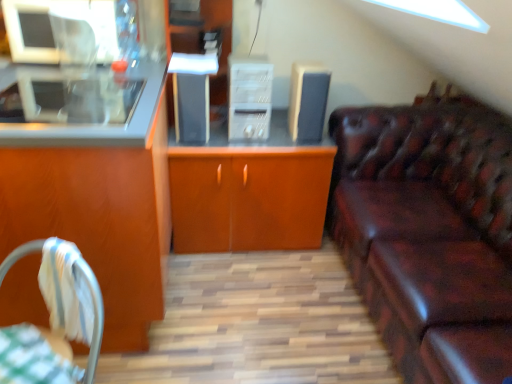
Question: Is satin black speaker at center, which appears as the second appliance when viewed from the right, completely or partially outside of matte wood cabinet at left, acting as the second cabinetry starting from the right?

Choices:
 (A) yes
 (B) no

Answer: (A)

Question: Can you confirm if satin black speaker at center, which appears as the second appliance when viewed from the right, is smaller than matte wood cabinet at left, which is the first cabinetry in left-to-right order?

Choices:
 (A) yes
 (B) no

Answer: (A)

Question: Is satin black speaker at center, which appears as the second appliance when viewed from the right, looking in the opposite direction of matte wood cabinet at left, acting as the second cabinetry starting from the right?

Choices:
 (A) no
 (B) yes

Answer: (A)

Question: From the image's perspective, does satin black speaker at center, which appears as the second appliance when viewed from the right, appear higher than matte wood cabinet at left, acting as the second cabinetry starting from the right?

Choices:
 (A) no
 (B) yes

Answer: (B)

Question: Is satin black speaker at center, which appears as the second appliance when viewed from the right, touching matte wood cabinet at left, acting as the second cabinetry starting from the right?

Choices:
 (A) no
 (B) yes

Answer: (A)

Question: Can you confirm if satin black speaker at center, which ranks as the first appliance in left-to-right order, is shorter than matte wood cabinet at left, acting as the second cabinetry starting from the right?

Choices:
 (A) yes
 (B) no

Answer: (A)

Question: Would you say white fabric chair at lower left contains leather couch at right?

Choices:
 (A) yes
 (B) no

Answer: (B)

Question: Considering the relative sizes of white fabric chair at lower left and leather couch at right in the image provided, is white fabric chair at lower left thinner than leather couch at right?

Choices:
 (A) yes
 (B) no

Answer: (A)

Question: Is the surface of white fabric chair at lower left in direct contact with leather couch at right?

Choices:
 (A) no
 (B) yes

Answer: (A)

Question: From the image's perspective, is white fabric chair at lower left located above leather couch at right?

Choices:
 (A) yes
 (B) no

Answer: (B)

Question: Considering the relative sizes of white fabric chair at lower left and leather couch at right in the image provided, is white fabric chair at lower left smaller than leather couch at right?

Choices:
 (A) yes
 (B) no

Answer: (A)

Question: Considering the relative sizes of white fabric chair at lower left and leather couch at right in the image provided, is white fabric chair at lower left wider than leather couch at right?

Choices:
 (A) yes
 (B) no

Answer: (B)

Question: Is wooden cabinet at center, the 2th cabinetry when ordered from left to right, aimed at green checkered tablecloth at lower left?

Choices:
 (A) no
 (B) yes

Answer: (B)